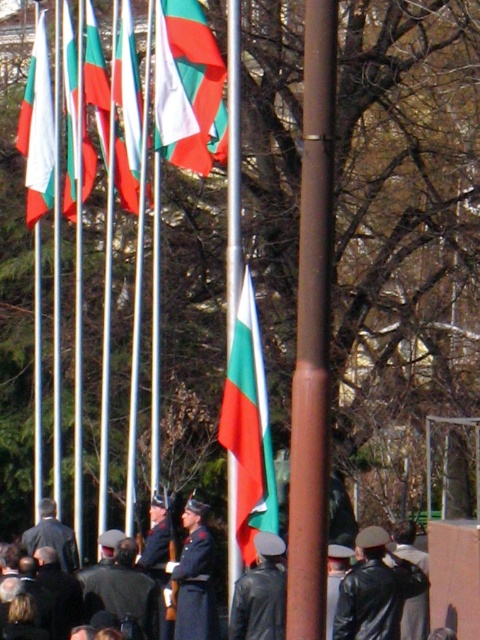
From the picture: Between white glossy flag at upper left and red and white striped flag at center, which one appears on the left side from the viewer's perspective?

white glossy flag at upper left

I want to click on white glossy flag at upper left, so click(37, 129).

Which is in front, point (33, 147) or point (70, 161)?

Point (70, 161) is more forward.

At what (x,y) coordinates should I click in order to perform the action: click on white glossy flag at upper left. Please return your answer as a coordinate pair (x, y). Looking at the image, I should click on (37, 129).

Between point (323, 461) and point (99, 570), which one is positioned behind?

Point (99, 570)

How much distance is there between brown polished pole at center and black leather uniform at center?

brown polished pole at center is 16.33 feet away from black leather uniform at center.

Image resolution: width=480 pixels, height=640 pixels. In order to click on brown polished pole at center in this screenshot , I will do `click(312, 332)`.

Can you confirm if leather jacket at center is thinner than dark gray uniform at center?

Incorrect, leather jacket at center's width is not less than dark gray uniform at center's.

Image resolution: width=480 pixels, height=640 pixels. Describe the element at coordinates (259, 602) in the screenshot. I see `leather jacket at center` at that location.

Locate an element on the screen. This screenshot has height=640, width=480. leather jacket at center is located at coordinates pyautogui.click(x=259, y=602).